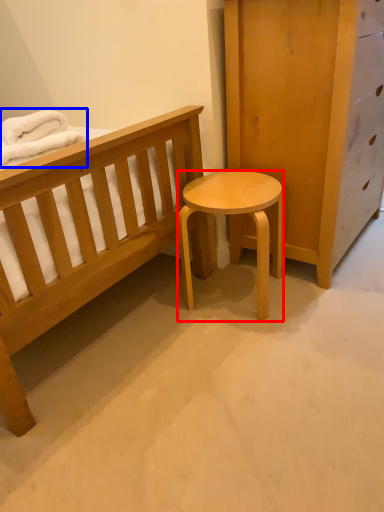
Question: Which of the following is the closest to the observer, stool (highlighted by a red box) or blanket (highlighted by a blue box)?

Choices:
 (A) stool
 (B) blanket

Answer: (B)